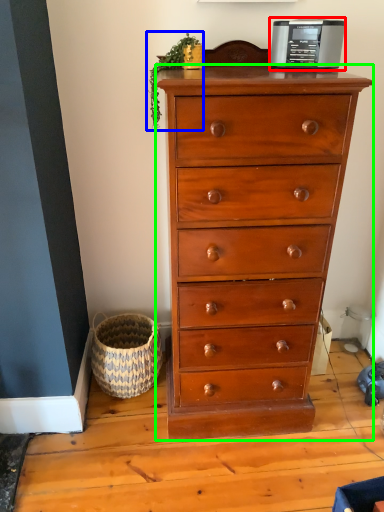
Question: Considering the real-world distances, which object is farthest from appliance (highlighted by a red box)? plant (highlighted by a blue box) or chest of drawers (highlighted by a green box)?

Choices:
 (A) plant
 (B) chest of drawers

Answer: (B)